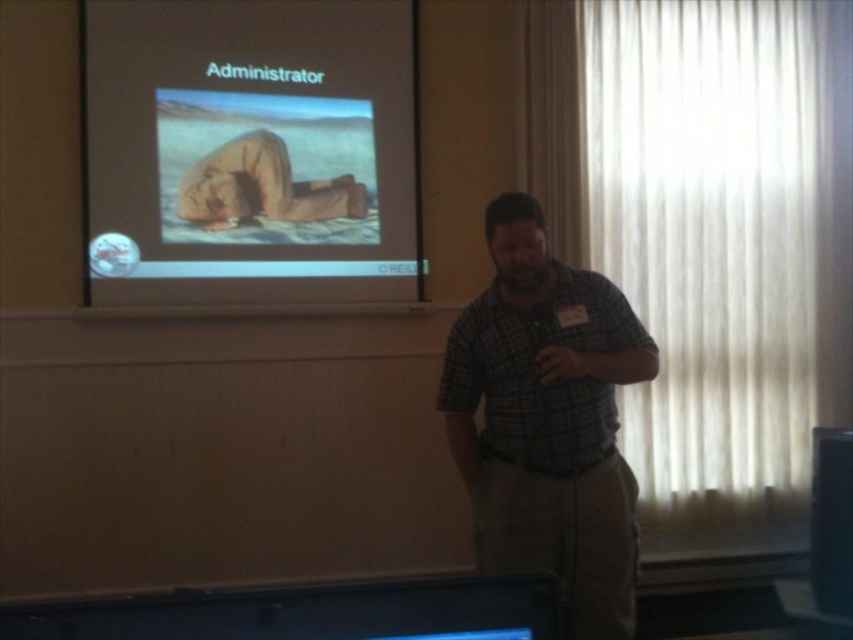
Measure the distance between matte projector screen at upper left and green plaid shirt at center.

4.73 feet

Between matte projector screen at upper left and green plaid shirt at center, which one appears on the right side from the viewer's perspective?

green plaid shirt at center is more to the right.

Which is in front, point (355, 10) or point (582, 422)?

Point (582, 422) is in front.

This screenshot has width=853, height=640. I want to click on matte projector screen at upper left, so click(x=250, y=150).

Is green plaid shirt at center taller than tan fabric pants at center?

Indeed, green plaid shirt at center has a greater height compared to tan fabric pants at center.

Which of these two, green plaid shirt at center or tan fabric pants at center, stands taller?

Standing taller between the two is green plaid shirt at center.

Between point (558, 522) and point (305, 221), which one is positioned in front?

Point (558, 522) is in front.

This screenshot has height=640, width=853. I want to click on green plaid shirt at center, so click(547, 420).

Looking at this image, is matte projector screen at upper left wider than tan fabric pants at center?

Yes.

How distant is matte projector screen at upper left from tan fabric pants at center?

The distance of matte projector screen at upper left from tan fabric pants at center is 5.84 inches.

Which is behind, point (94, 147) or point (224, 156)?

The point (224, 156) is more distant.

This screenshot has width=853, height=640. I want to click on matte projector screen at upper left, so point(250,150).